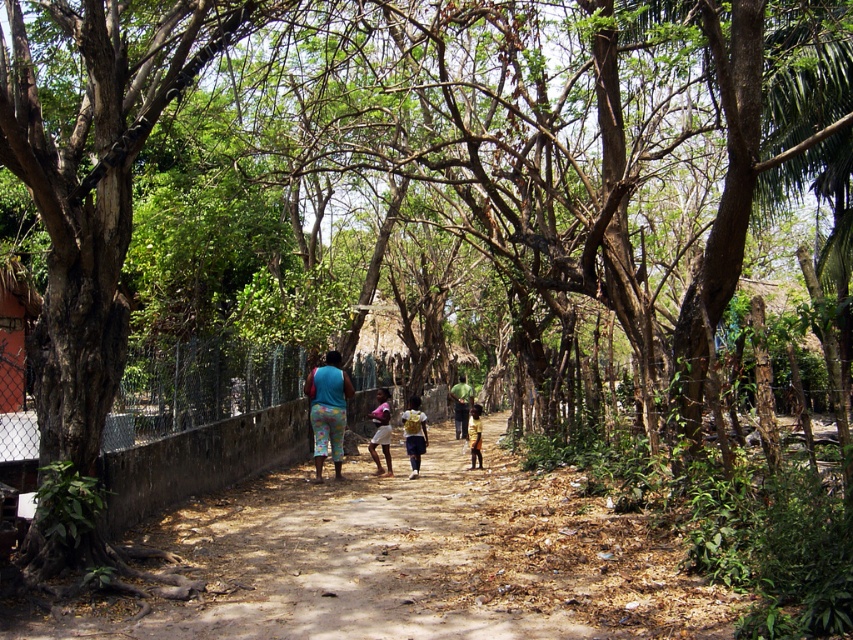
Which is above, chain-link fence at center or pink fabric dress at center?

Positioned higher is chain-link fence at center.

Is chain-link fence at center wider than pink fabric dress at center?

Yes.

The image size is (853, 640). Describe the element at coordinates (198, 385) in the screenshot. I see `chain-link fence at center` at that location.

The image size is (853, 640). I want to click on chain-link fence at center, so click(x=198, y=385).

Can you confirm if yellow fabric backpack at center is shorter than dark green fabric at center?

Yes, yellow fabric backpack at center is shorter than dark green fabric at center.

Which is below, yellow fabric backpack at center or dark green fabric at center?

dark green fabric at center

Between point (421, 426) and point (457, 388), which one is positioned in front?

Point (421, 426) is more forward.

What are the coordinates of `yellow fabric backpack at center` in the screenshot? It's located at (415, 433).

Which of these two, yellow fabric backpack at center or yellow fabric child at center, stands shorter?

A: With less height is yellow fabric child at center.

Is point (421, 428) positioned behind point (480, 464)?

That is False.

Locate an element on the screen. This screenshot has width=853, height=640. yellow fabric backpack at center is located at coordinates (415, 433).